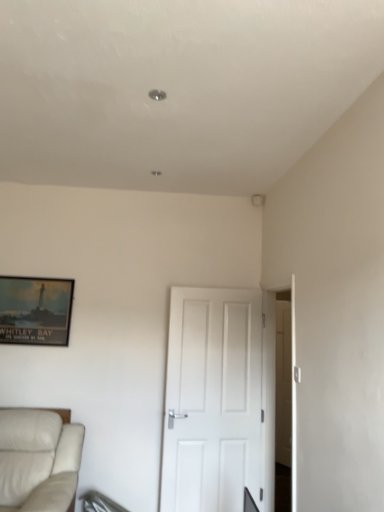
Question: Is matte black picture frame at upper left wider or thinner than white leather studio couch at lower left?

Choices:
 (A) wide
 (B) thin

Answer: (B)

Question: From a real-world perspective, is matte black picture frame at upper left above or below white leather studio couch at lower left?

Choices:
 (A) above
 (B) below

Answer: (A)

Question: Which object is positioned closest to the matte black picture frame at upper left?

Choices:
 (A) white matte door at center
 (B) white leather studio couch at lower left

Answer: (B)

Question: Estimate the real-world distances between objects in this image. Which object is closer to the white matte door at center?

Choices:
 (A) matte black picture frame at upper left
 (B) white leather studio couch at lower left

Answer: (B)